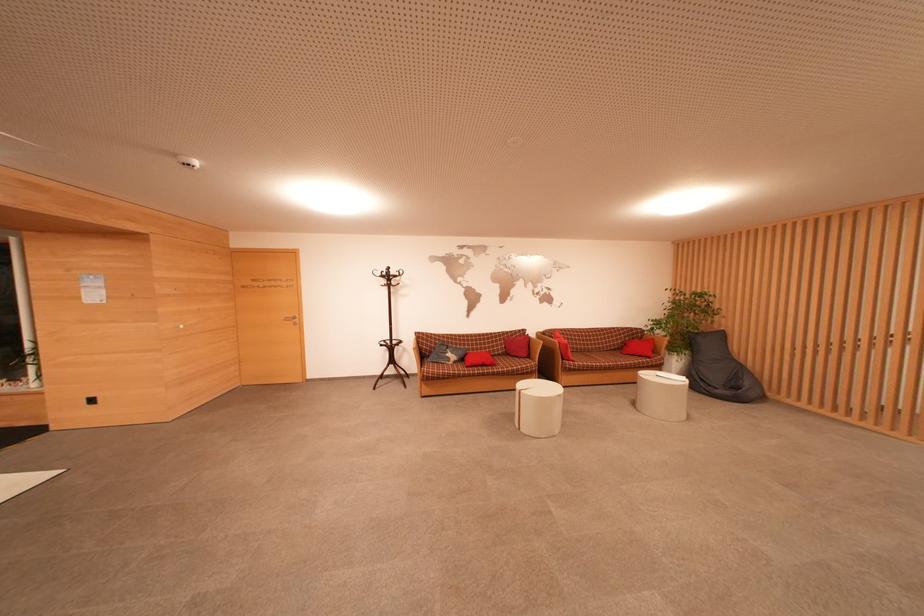
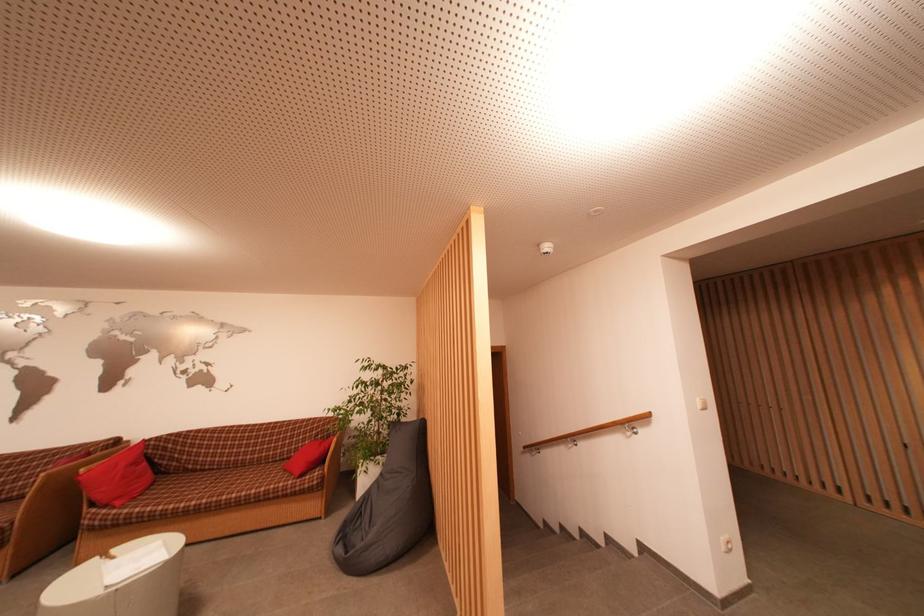
In the second image, find the point that corresponds to (725,339) in the first image.

(426, 430)